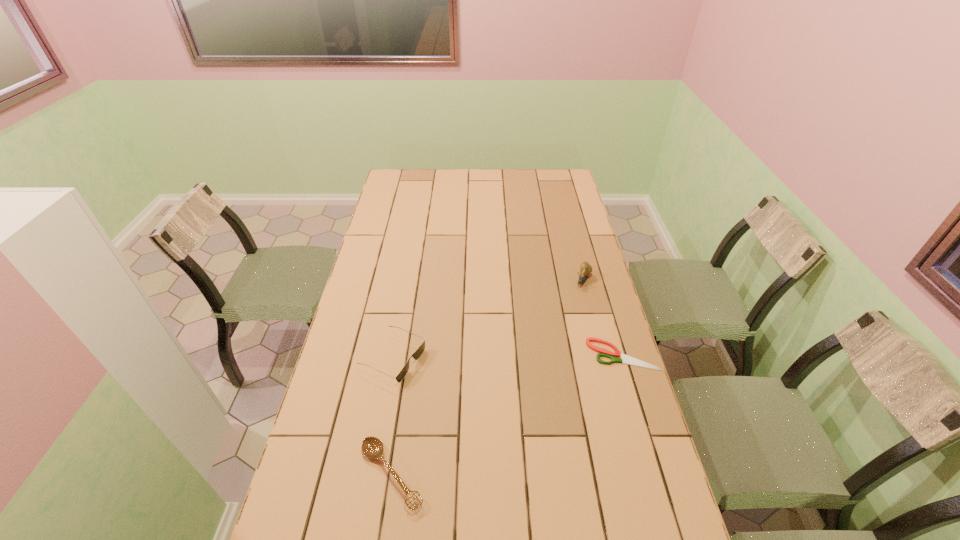
The height and width of the screenshot is (540, 960). What are the coordinates of `vacant space at the far edge of the desktop` in the screenshot? It's located at (482, 191).

The width and height of the screenshot is (960, 540). I want to click on free space at the near edge of the desktop, so click(x=383, y=517).

Identify the location of free space at the left edge of the desktop. Image resolution: width=960 pixels, height=540 pixels. (397, 234).

The width and height of the screenshot is (960, 540). In order to click on free space at the right edge of the desktop in this screenshot , I will do `click(570, 206)`.

In the image, there is a desktop. Where is `vacant space at the far right corner`? This screenshot has height=540, width=960. vacant space at the far right corner is located at coordinates (562, 176).

Locate an element on the screen. The width and height of the screenshot is (960, 540). empty space that is in between the third tallest object and the scissors is located at coordinates (507, 414).

The image size is (960, 540). I want to click on free point between the ladle and the shortest object, so click(x=507, y=414).

Image resolution: width=960 pixels, height=540 pixels. Find the location of `vacant space that's between the escargot and the sunglasses`. vacant space that's between the escargot and the sunglasses is located at coordinates (488, 319).

The height and width of the screenshot is (540, 960). Find the location of `empty space between the farthest object and the nearest object`. empty space between the farthest object and the nearest object is located at coordinates (488, 377).

Where is `vacant space that is in between the farthest object and the sunglasses`? vacant space that is in between the farthest object and the sunglasses is located at coordinates (488, 319).